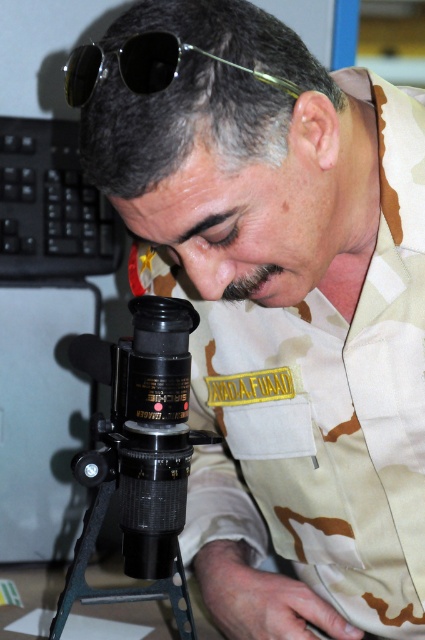
You are a photographer who needs to adjust the black plastic camera at center and the black shiny sunglasses at upper center. Since you have a limited workspace, can you reach both items without moving your position? The minimum required distance between them for comfortable adjustment is 12 inches.

The black plastic camera at center and the black shiny sunglasses at upper center are 12.34 inches apart, which is just over the minimum required distance of 12 inches. Therefore, you can comfortably adjust both items without moving your position.

You are a photographer trying to take a picture of the microscope. You have a black plastic camera at center and black shiny sunglasses at upper center. Which object should you use to capture the image, and why?

You should use the black plastic camera at center to capture the image because it is designed for taking pictures, while the black shiny sunglasses at upper center are for eye protection and do not have photography capabilities.

What object is located at the coordinates point [144,428] in the image?

The point [144,428] corresponds to the black plastic camera at center.